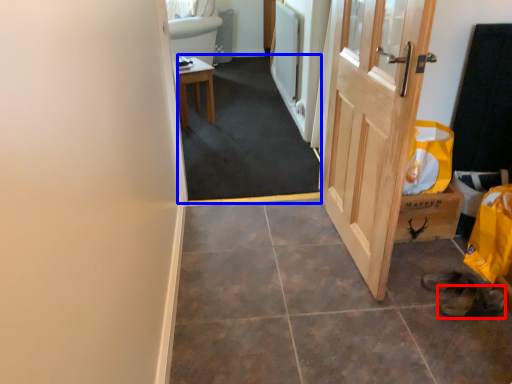
Question: Which object appears closest to the camera in this image, shoe (highlighted by a red box) or corridor (highlighted by a blue box)?

Choices:
 (A) shoe
 (B) corridor

Answer: (A)